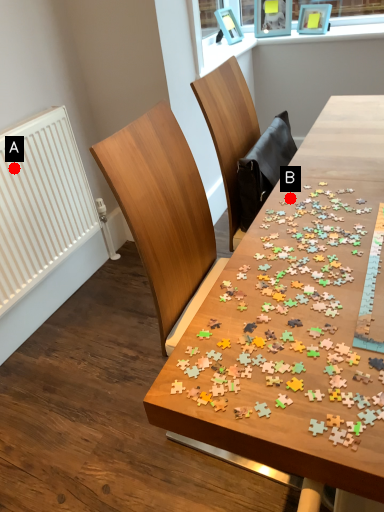
Question: Two points are circled on the image, labeled by A and B beside each circle. Which point is further to the camera?

Choices:
 (A) A is further
 (B) B is further

Answer: (A)